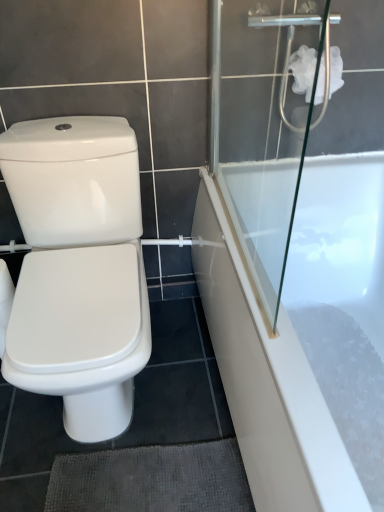
Question: Is white fluffy toilet paper at upper right positioned behind transparent glass shower door at upper right?

Choices:
 (A) yes
 (B) no

Answer: (A)

Question: Is white fluffy toilet paper at upper right smaller than transparent glass shower door at upper right?

Choices:
 (A) yes
 (B) no

Answer: (A)

Question: Considering the relative sizes of white fluffy toilet paper at upper right and transparent glass shower door at upper right in the image provided, is white fluffy toilet paper at upper right taller than transparent glass shower door at upper right?

Choices:
 (A) no
 (B) yes

Answer: (A)

Question: Is white fluffy toilet paper at upper right oriented away from transparent glass shower door at upper right?

Choices:
 (A) no
 (B) yes

Answer: (A)

Question: Can you confirm if white fluffy toilet paper at upper right is positioned to the left of transparent glass shower door at upper right?

Choices:
 (A) yes
 (B) no

Answer: (B)

Question: From a real-world perspective, relative to white glossy bathtub at right, is white glossy bidet at left vertically above or below?

Choices:
 (A) below
 (B) above

Answer: (B)

Question: Choose the correct answer: Is white glossy bidet at left inside white glossy bathtub at right or outside it?

Choices:
 (A) inside
 (B) outside

Answer: (B)

Question: Is point (26, 385) closer or farther from the camera than point (240, 398)?

Choices:
 (A) closer
 (B) farther

Answer: (A)

Question: In terms of width, does white glossy bidet at left look wider or thinner when compared to white glossy bathtub at right?

Choices:
 (A) wide
 (B) thin

Answer: (B)

Question: In the image, is white glossy bathtub at right on the left side or the right side of white glossy bidet at left?

Choices:
 (A) right
 (B) left

Answer: (A)

Question: Would you say white glossy bathtub at right is inside or outside white glossy bidet at left?

Choices:
 (A) outside
 (B) inside

Answer: (A)

Question: From the image's perspective, relative to white glossy bidet at left, is white glossy bathtub at right above or below?

Choices:
 (A) below
 (B) above

Answer: (A)

Question: Considering the positions of white glossy bathtub at right and white glossy bidet at left in the image, is white glossy bathtub at right bigger or smaller than white glossy bidet at left?

Choices:
 (A) big
 (B) small

Answer: (A)

Question: Is point (350, 498) closer or farther from the camera than point (319, 56)?

Choices:
 (A) farther
 (B) closer

Answer: (B)

Question: Considering the positions of white glossy bathtub at right and transparent glass shower door at upper right in the image, is white glossy bathtub at right taller or shorter than transparent glass shower door at upper right?

Choices:
 (A) tall
 (B) short

Answer: (B)